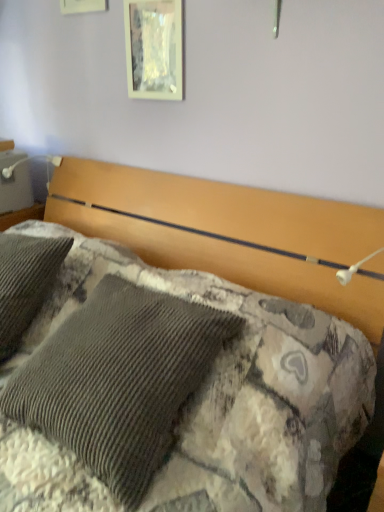
You are a GUI agent. You are given a task and a screenshot of the screen. Output one action in this format:
    pyautogui.click(x=<x>, y=<y>)
    Task: Click on the metallic glass picture frame at upper center
    
    Given the screenshot: What is the action you would take?
    pyautogui.click(x=154, y=49)

Describe the element at coordinates (154, 49) in the screenshot. Image resolution: width=384 pixels, height=512 pixels. I see `metallic glass picture frame at upper center` at that location.

From the picture: What is the approximate width of corduroy fabric bed at center?

corduroy fabric bed at center is 36.30 inches in width.

From the picture: In order to face corduroy fabric bed at center, should I rotate leftwards or rightwards?

Rotate your view left by about 10.210°.

The image size is (384, 512). What do you see at coordinates (226, 232) in the screenshot?
I see `corduroy fabric bed at center` at bounding box center [226, 232].

Find the location of a particular element. The image size is (384, 512). corduroy fabric bed at center is located at coordinates 226,232.

Image resolution: width=384 pixels, height=512 pixels. Identify the location of metallic glass picture frame at upper center. (154, 49).

Considering the positions of objects metallic glass picture frame at upper center and corduroy fabric bed at center in the image provided, who is more to the left, metallic glass picture frame at upper center or corduroy fabric bed at center?

corduroy fabric bed at center is more to the left.

Looking at this image, which is behind, metallic glass picture frame at upper center or corduroy fabric bed at center?

metallic glass picture frame at upper center is further away from the camera.

Considering the points (173, 94) and (169, 187), which point is in front, point (173, 94) or point (169, 187)?

The point (173, 94) is in front.

From the image's perspective, which one is positioned higher, metallic glass picture frame at upper center or corduroy fabric bed at center?

metallic glass picture frame at upper center, from the image's perspective.

From a real-world perspective, is metallic glass picture frame at upper center physically located above or below corduroy fabric bed at center?

Clearly, from a real-world perspective, metallic glass picture frame at upper center is above corduroy fabric bed at center.

Can you confirm if metallic glass picture frame at upper center is thinner than corduroy fabric bed at center?

Yes.

Between metallic glass picture frame at upper center and corduroy fabric bed at center, which one has more height?

corduroy fabric bed at center is taller.

Considering the relative sizes of metallic glass picture frame at upper center and corduroy fabric bed at center in the image provided, is metallic glass picture frame at upper center smaller than corduroy fabric bed at center?

Yes, metallic glass picture frame at upper center is smaller than corduroy fabric bed at center.

Would you say corduroy fabric bed at center is part of metallic glass picture frame at upper center's contents?

No, metallic glass picture frame at upper center does not contain corduroy fabric bed at center.

Is metallic glass picture frame at upper center far from corduroy fabric bed at center?

metallic glass picture frame at upper center is near corduroy fabric bed at center, not far away.

Is metallic glass picture frame at upper center facing towards corduroy fabric bed at center?

No, metallic glass picture frame at upper center is not aimed at corduroy fabric bed at center.

Identify the location of picture frame located above the corduroy fabric bed at center (from the image's perspective). (154, 49).

Which object is positioned more to the left, corduroy fabric bed at center or metallic glass picture frame at upper center?

corduroy fabric bed at center.

Looking at this image, considering their positions, is corduroy fabric bed at center located in front of or behind metallic glass picture frame at upper center?

Clearly, corduroy fabric bed at center is in front of metallic glass picture frame at upper center.

Considering the positions of point (361, 241) and point (132, 5), is point (361, 241) closer or farther from the camera than point (132, 5)?

Point (361, 241).

From the image's perspective, which is below, corduroy fabric bed at center or metallic glass picture frame at upper center?

corduroy fabric bed at center, from the image's perspective.

From a real-world perspective, who is located higher, corduroy fabric bed at center or metallic glass picture frame at upper center?

metallic glass picture frame at upper center is physically above.

Is corduroy fabric bed at center wider or thinner than metallic glass picture frame at upper center?

Considering their sizes, corduroy fabric bed at center looks broader than metallic glass picture frame at upper center.

Can you confirm if corduroy fabric bed at center is shorter than metallic glass picture frame at upper center?

In fact, corduroy fabric bed at center may be taller than metallic glass picture frame at upper center.

Looking at the image, does corduroy fabric bed at center seem bigger or smaller compared to metallic glass picture frame at upper center?

Considering their sizes, corduroy fabric bed at center takes up more space than metallic glass picture frame at upper center.

Is corduroy fabric bed at center positioned beyond the bounds of metallic glass picture frame at upper center?

Yes, corduroy fabric bed at center is located beyond the bounds of metallic glass picture frame at upper center.

Is there a large distance between corduroy fabric bed at center and metallic glass picture frame at upper center?

No, corduroy fabric bed at center is in close proximity to metallic glass picture frame at upper center.

Is corduroy fabric bed at center positioned with its back to metallic glass picture frame at upper center?

No, corduroy fabric bed at center is not facing away from metallic glass picture frame at upper center.

Consider the image. How many degrees apart are the facing directions of corduroy fabric bed at center and metallic glass picture frame at upper center?

The angle between the facing direction of corduroy fabric bed at center and the facing direction of metallic glass picture frame at upper center is 0.0046 degrees.

Find the location of `bed below the metallic glass picture frame at upper center (from the image's perspective)`. bed below the metallic glass picture frame at upper center (from the image's perspective) is located at coordinates (226, 232).

Find the location of `picture frame on the right of the corduroy fabric bed at center`. picture frame on the right of the corduroy fabric bed at center is located at coordinates (154, 49).

Find the location of a particular element. The image size is (384, 512). picture frame located above the corduroy fabric bed at center (from a real-world perspective) is located at coordinates (154, 49).